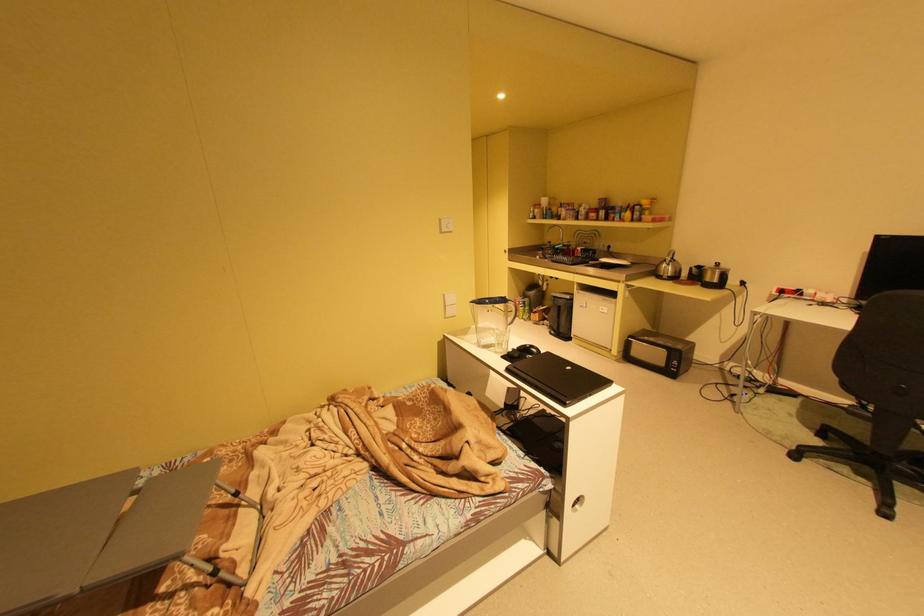
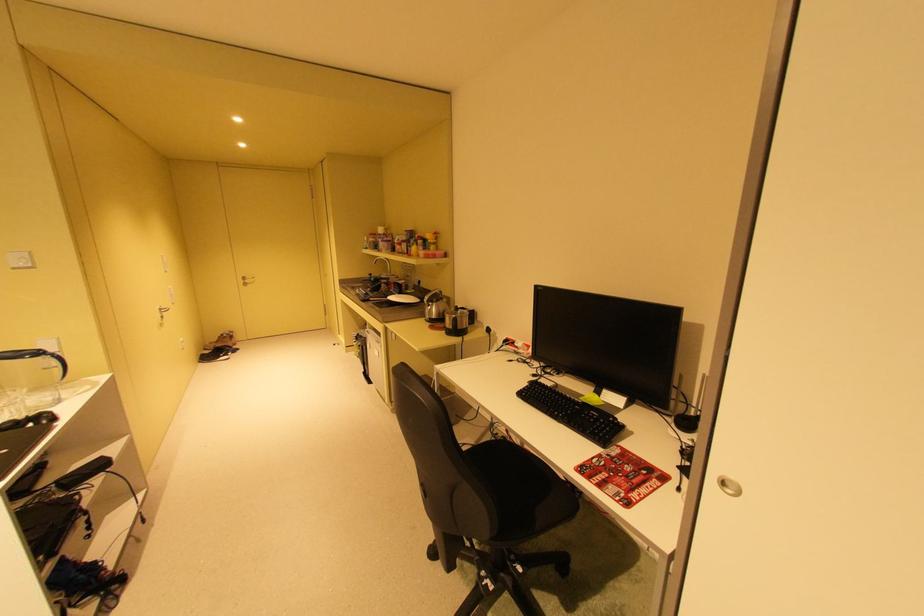
Question: Which direction would the cameraman need to move to produce the second image? Reply with the corresponding letter.

Choices:
 (A) Left
 (B) Right
 (C) Forward
 (D) Backward

Answer: (B)